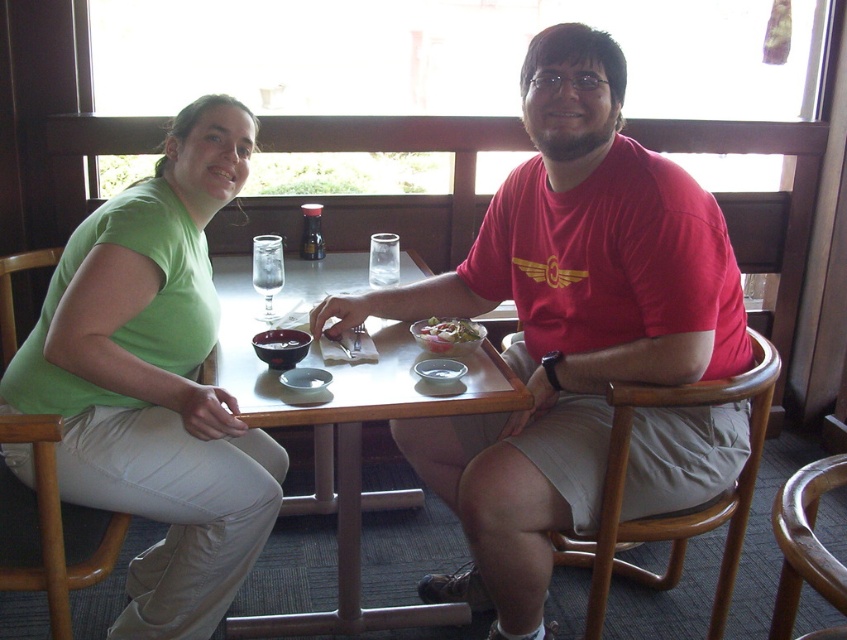
Who is more distant from viewer, (x=702, y=196) or (x=331, y=477)?

The point (x=331, y=477) is more distant.

Based on the photo, can you confirm if red matte shirt at center is bigger than wooden tray at center?

Correct, red matte shirt at center is larger in size than wooden tray at center.

Which is behind, point (729, 424) or point (328, 285)?

Positioned behind is point (328, 285).

Locate an element on the screen. red matte shirt at center is located at coordinates (563, 323).

Can you confirm if wooden tray at center is wider than white creamy bowl at center?

Correct, the width of wooden tray at center exceeds that of white creamy bowl at center.

Is wooden tray at center above white creamy bowl at center?

Yes, wooden tray at center is above white creamy bowl at center.

Who is more distant from viewer, (286, 401) or (452, 353)?

The point (452, 353) is behind.

The width and height of the screenshot is (847, 640). Identify the location of wooden tray at center. (344, 440).

Looking at this image, is green cotton shirt at left positioned at the back of white creamy bowl at center?

No, green cotton shirt at left is in front of white creamy bowl at center.

Does point (65, 392) come farther from viewer compared to point (449, 321)?

No, (65, 392) is closer to viewer.

You are a GUI agent. You are given a task and a screenshot of the screen. Output one action in this format:
    pyautogui.click(x=<x>, y=<y>)
    Task: Click on the green cotton shirt at left
    This screenshot has height=640, width=847.
    Given the screenshot: What is the action you would take?
    [156, 381]